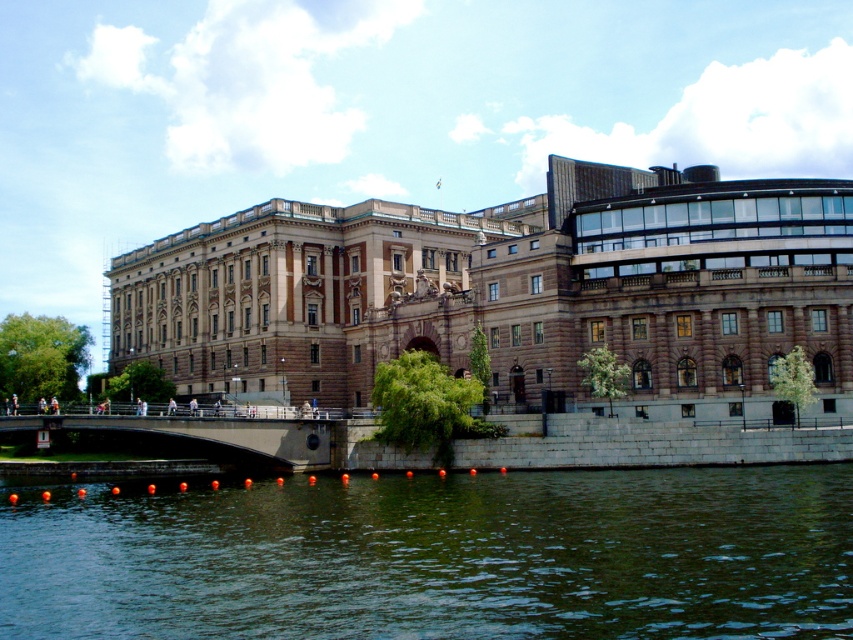
Is greenish water at lower center below concrete bridge at center?

Yes, greenish water at lower center is below concrete bridge at center.

Can you confirm if greenish water at lower center is positioned to the right of concrete bridge at center?

Yes, greenish water at lower center is to the right of concrete bridge at center.

Image resolution: width=853 pixels, height=640 pixels. Identify the location of greenish water at lower center. (439, 556).